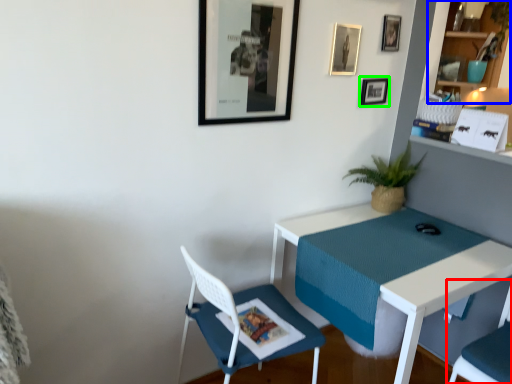
Question: Which object is the closest to the chair (highlighted by a red box)? Choose among these: shelf (highlighted by a blue box) or picture frame (highlighted by a green box).

Choices:
 (A) shelf
 (B) picture frame

Answer: (B)